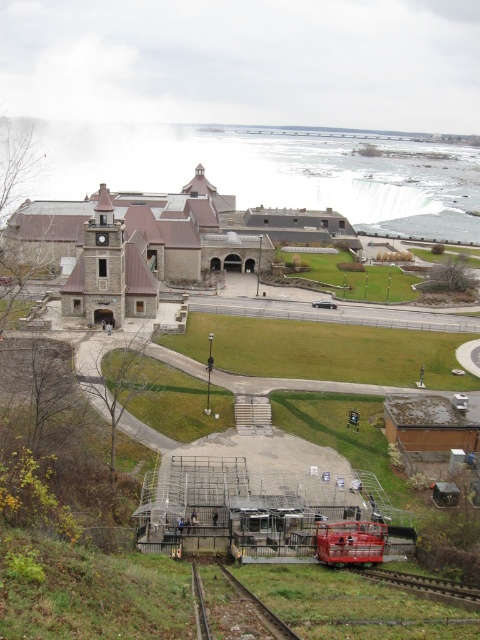
Question: Is metallic rail at lower center positioned before metallic red train at center?

Choices:
 (A) yes
 (B) no

Answer: (A)

Question: Which point is closer to the camera?

Choices:
 (A) metallic smooth train track at lower right
 (B) metallic red train at center

Answer: (A)

Question: Is metallic red train at center thinner than metallic smooth train track at lower right?

Choices:
 (A) yes
 (B) no

Answer: (A)

Question: Is metallic red train at center behind metallic smooth train track at lower right?

Choices:
 (A) yes
 (B) no

Answer: (A)

Question: Among these points, which one is farthest from the camera?

Choices:
 (A) (204, 580)
 (B) (458, 589)
 (C) (327, 536)

Answer: (C)

Question: Estimate the real-world distances between objects in this image. Which object is farther from the metallic rail at lower center?

Choices:
 (A) metallic red train at center
 (B) metallic smooth train track at lower right

Answer: (B)